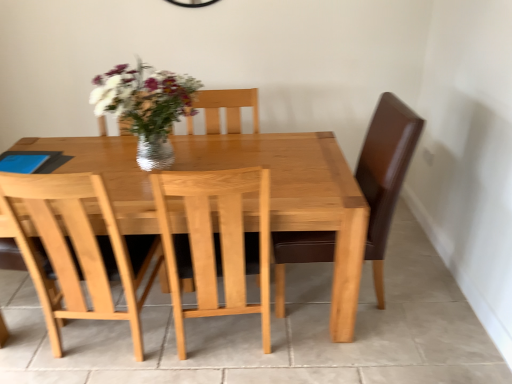
Question: From a real-world perspective, is light wood chair at center physically located above or below shiny silver vase at center?

Choices:
 (A) above
 (B) below

Answer: (B)

Question: Would you say light wood chair at center is to the left or to the right of shiny silver vase at center in the picture?

Choices:
 (A) right
 (B) left

Answer: (A)

Question: Considering the real-world distances, which object is farthest from the shiny silver vase at center?

Choices:
 (A) light wood chair at center
 (B) light brown wooden table at center

Answer: (A)

Question: Estimate the real-world distances between objects in this image. Which object is farther from the light brown wooden table at center?

Choices:
 (A) light wood chair at center
 (B) shiny silver vase at center

Answer: (B)